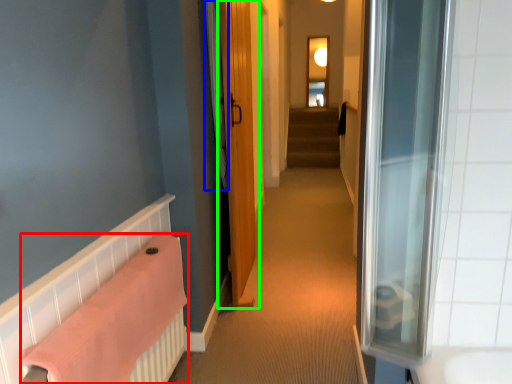
Question: Considering the real-world distances, which object is farthest from bath towel (highlighted by a red box)? shower curtain (highlighted by a blue box) or door (highlighted by a green box)?

Choices:
 (A) shower curtain
 (B) door

Answer: (B)